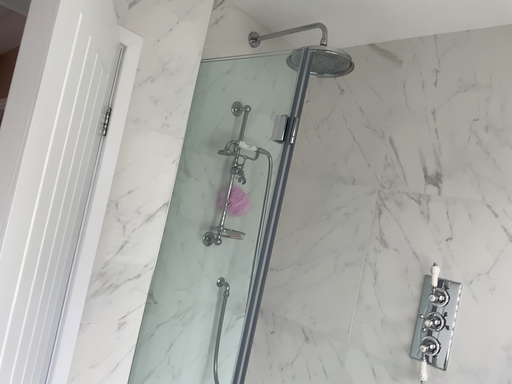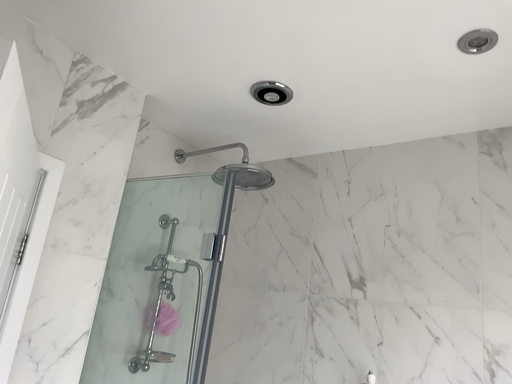
Question: Which way did the camera rotate in the video?

Choices:
 (A) rotated downward
 (B) rotated upward

Answer: (B)